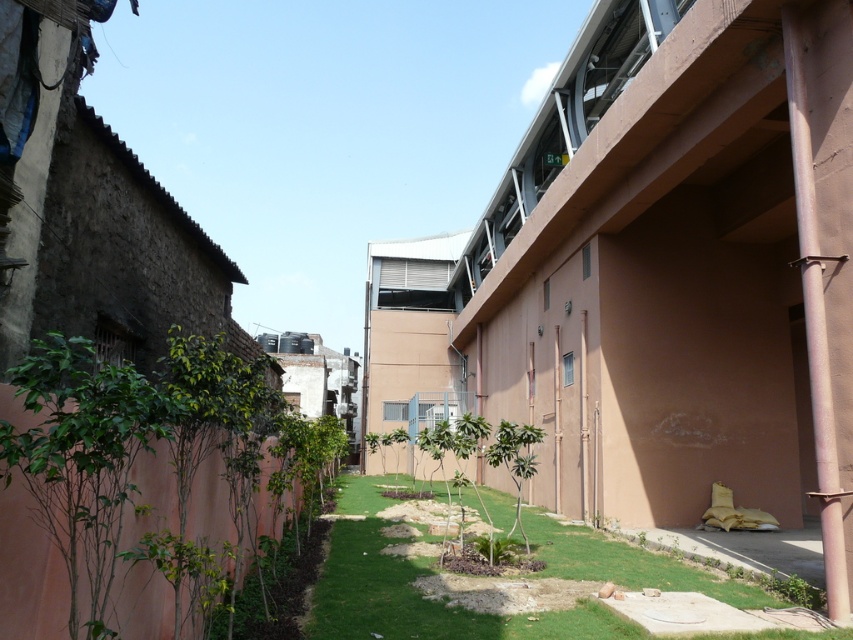
Question: Is green grass at center above brown concrete pipe at right?

Choices:
 (A) no
 (B) yes

Answer: (A)

Question: Among these points, which one is farthest from the camera?

Choices:
 (A) (376, 493)
 (B) (808, 196)

Answer: (A)

Question: Can you confirm if green grass at center is positioned above brown concrete pipe at right?

Choices:
 (A) yes
 (B) no

Answer: (B)

Question: Does green grass at center appear on the right side of brown concrete pipe at right?

Choices:
 (A) no
 (B) yes

Answer: (A)

Question: Which of the following is the farthest from the observer?

Choices:
 (A) (822, 492)
 (B) (363, 525)

Answer: (B)